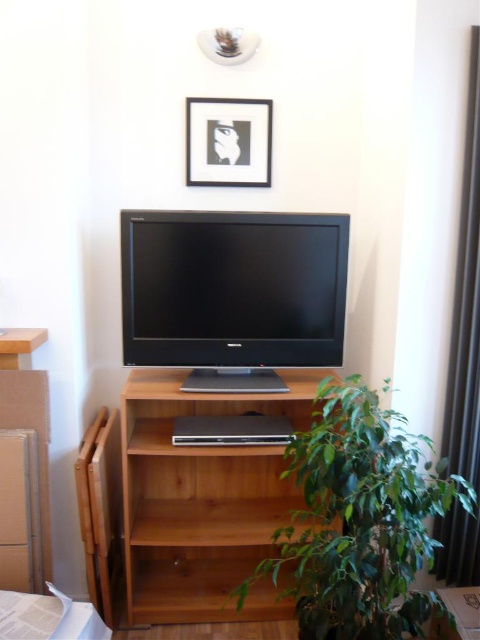
Question: In this image, where is satin black flat screen tv at center located relative to white paper at lower left?

Choices:
 (A) right
 (B) left

Answer: (A)

Question: Which point appears closest to the camera in this image?

Choices:
 (A) click(73, 612)
 (B) click(240, 156)

Answer: (A)

Question: Which is farther from the green leafy plant at lower right?

Choices:
 (A) satin black flat screen tv at center
 (B) white paper at lower left
 (C) wooden table at lower right
 (D) white matte picture frame at upper center

Answer: (D)

Question: Based on their relative distances, which object is farther from the light brown wood shelf at center?

Choices:
 (A) satin black flat screen tv at center
 (B) green leafy plant at lower right
 (C) white matte picture frame at upper center

Answer: (C)

Question: In this image, where is green leafy plant at lower right located relative to white paper at lower left?

Choices:
 (A) left
 (B) right

Answer: (B)

Question: Does light brown wood shelf at center have a larger size compared to white matte picture frame at upper center?

Choices:
 (A) yes
 (B) no

Answer: (A)